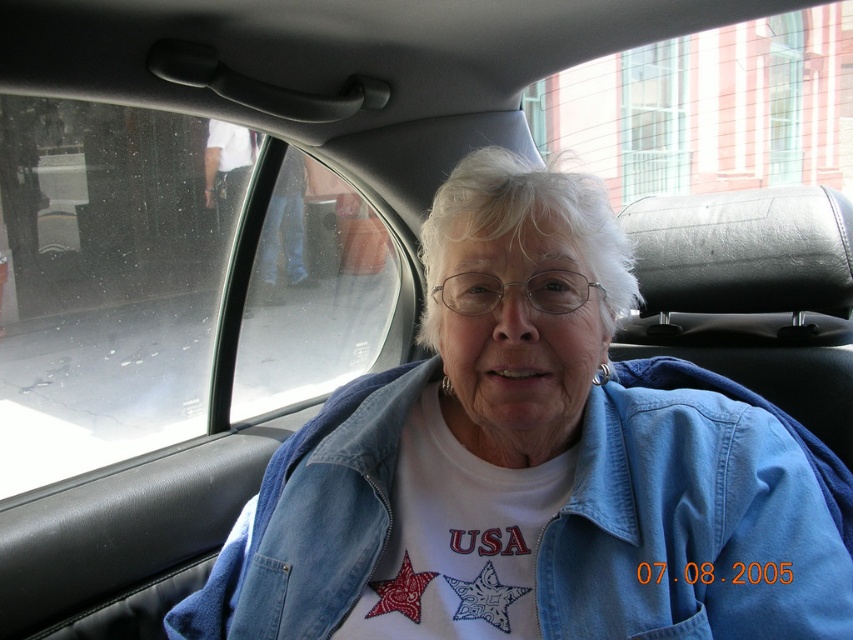
You are a fashion designer observing the elderly woman in the car. You need to determine the relative sizes of the denim jacket at lower right and the black leather headrest at upper right. Which object is shorter?

The denim jacket at lower right is shorter than the black leather headrest at upper right.

You are a passenger in the car and want to look at the building outside through the transparent glass window at upper left. Can you see the denim jacket at lower right in your line of sight when looking through the window?

The transparent glass window at upper left is positioned over the denim jacket at lower right, so when looking through the window, the denim jacket at lower right would block your view of the building outside.